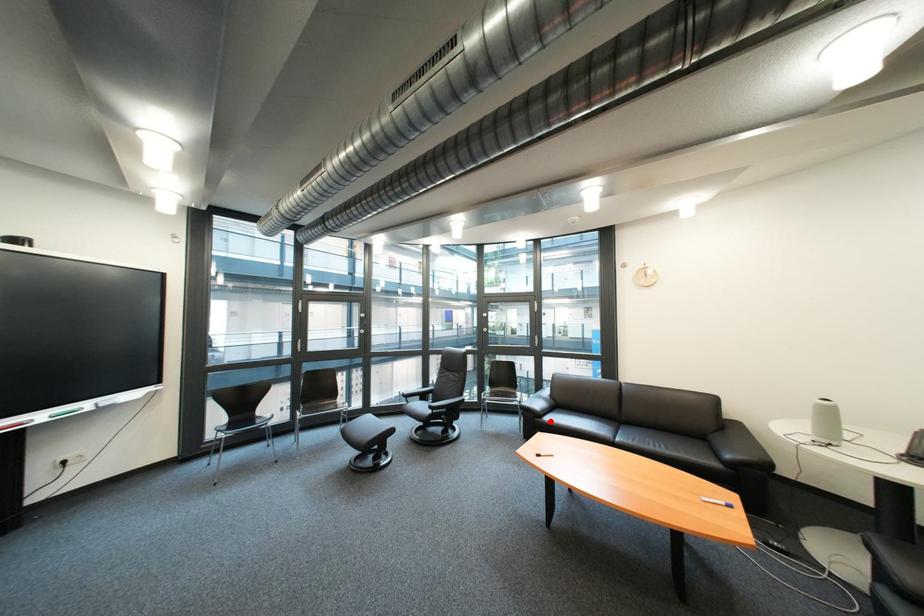
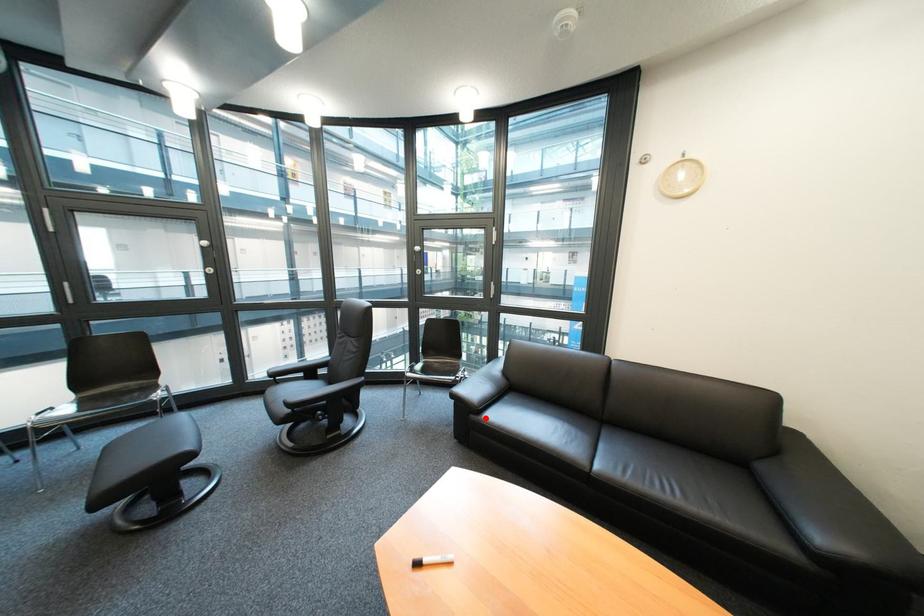
I am providing you with two images of the same scene from different viewpoints. A red point is marked on the first image and another point is marked on the second image. Are the points marked in image1 and image2 representing the same 3D position?

Yes